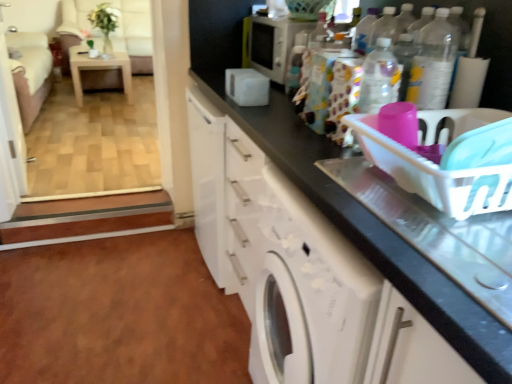
Where is `vacant space behind white glossy screen door at upper left`? Image resolution: width=512 pixels, height=384 pixels. vacant space behind white glossy screen door at upper left is located at coordinates (66, 149).